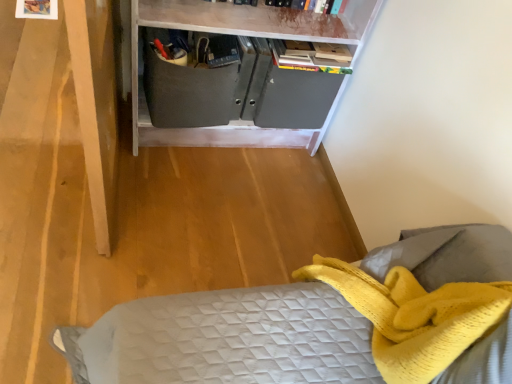
Question: Does matte gray cabinet at center come in front of matte gray cabinet at center?

Choices:
 (A) no
 (B) yes

Answer: (B)

Question: Is matte gray cabinet at center surrounded by matte gray cabinet at center?

Choices:
 (A) yes
 (B) no

Answer: (A)

Question: Is matte gray cabinet at center to the left of matte gray cabinet at center from the viewer's perspective?

Choices:
 (A) no
 (B) yes

Answer: (A)

Question: Does matte gray cabinet at center have a greater width compared to matte gray cabinet at center?

Choices:
 (A) no
 (B) yes

Answer: (B)

Question: Is matte gray cabinet at center next to matte gray cabinet at center and touching it?

Choices:
 (A) no
 (B) yes

Answer: (A)

Question: Considering the relative sizes of matte gray cabinet at center and matte gray cabinet at center in the image provided, is matte gray cabinet at center shorter than matte gray cabinet at center?

Choices:
 (A) no
 (B) yes

Answer: (A)

Question: From the image's perspective, is matte gray cabinet at center beneath matte gray cabinet at center?

Choices:
 (A) no
 (B) yes

Answer: (B)

Question: Can you confirm if matte gray cabinet at center is wider than matte gray cabinet at center?

Choices:
 (A) yes
 (B) no

Answer: (B)

Question: Are matte gray cabinet at center and matte gray cabinet at center making contact?

Choices:
 (A) no
 (B) yes

Answer: (A)

Question: Is matte gray cabinet at center looking in the opposite direction of matte gray cabinet at center?

Choices:
 (A) no
 (B) yes

Answer: (B)

Question: Considering the relative positions of matte gray cabinet at center and matte gray cabinet at center in the image provided, is matte gray cabinet at center to the right of matte gray cabinet at center from the viewer's perspective?

Choices:
 (A) no
 (B) yes

Answer: (A)

Question: From the image's perspective, does matte gray cabinet at center appear higher than matte gray cabinet at center?

Choices:
 (A) no
 (B) yes

Answer: (A)

Question: Considering the positions of matte gray cabinet at center and matte gray cabinet at center in the image, is matte gray cabinet at center bigger or smaller than matte gray cabinet at center?

Choices:
 (A) small
 (B) big

Answer: (A)